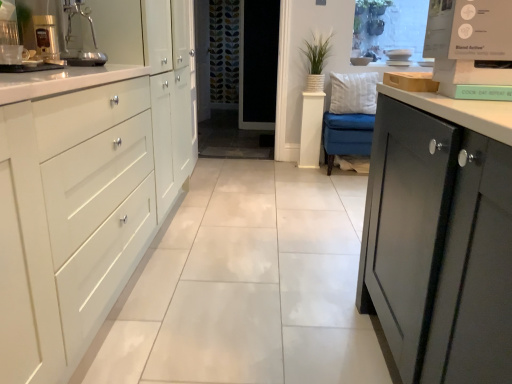
Question: In terms of size, does metallic silver coffee machine at upper left appear bigger or smaller than white plush pillow at center?

Choices:
 (A) small
 (B) big

Answer: (A)

Question: From the image's perspective, relative to white plush pillow at center, is metallic silver coffee machine at upper left above or below?

Choices:
 (A) below
 (B) above

Answer: (A)

Question: Which is farther from the white glossy cabinet at left?

Choices:
 (A) transparent glass screen door at center
 (B) metallic silver coffee machine at upper left
 (C) white plush pillow at center
 (D) green woven basket at center

Answer: (A)

Question: Which object is positioned closest to the white plush pillow at center?

Choices:
 (A) metallic silver coffee machine at upper left
 (B) green woven basket at center
 (C) white glossy cabinet at left
 (D) transparent glass screen door at center

Answer: (B)